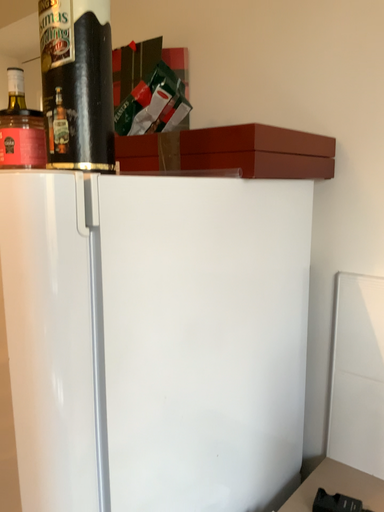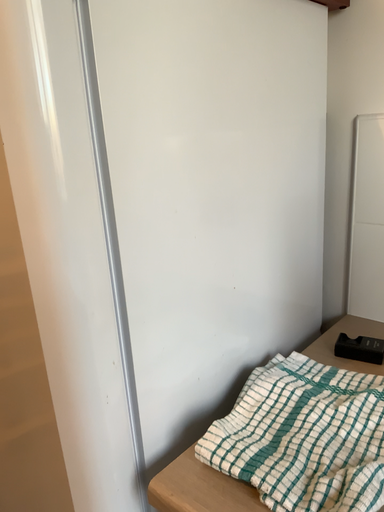
Question: How did the camera likely rotate when shooting the video?

Choices:
 (A) rotated downward
 (B) rotated upward

Answer: (A)